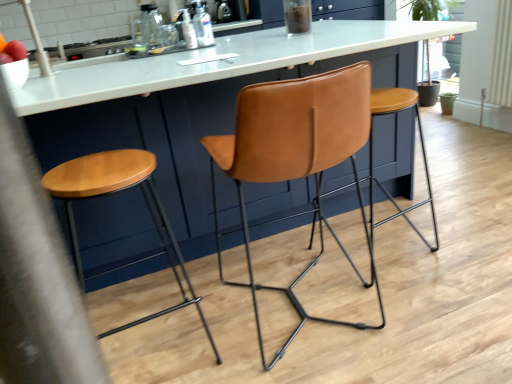
Question: Considering the relative positions of cognac leather chair at center and matte brown stool at center, which is counted as the first stool, starting from the left, in the image provided, is cognac leather chair at center to the right of matte brown stool at center, which is counted as the first stool, starting from the left, from the viewer's perspective?

Choices:
 (A) yes
 (B) no

Answer: (A)

Question: Does cognac leather chair at center have a lesser height compared to matte brown stool at center, which is counted as the first stool, starting from the left?

Choices:
 (A) yes
 (B) no

Answer: (B)

Question: Does cognac leather chair at center have a greater width compared to matte brown stool at center, which is counted as the first stool, starting from the left?

Choices:
 (A) no
 (B) yes

Answer: (B)

Question: Is cognac leather chair at center looking in the opposite direction of matte brown stool at center, which is counted as the first stool, starting from the left?

Choices:
 (A) yes
 (B) no

Answer: (B)

Question: Can you confirm if cognac leather chair at center is positioned to the left of matte brown stool at center, which is the 2th stool in right-to-left order?

Choices:
 (A) yes
 (B) no

Answer: (B)

Question: In the image, is matte brown stool at center, which is the 2th stool in right-to-left order, positioned in front of or behind cognac leather chair at center?

Choices:
 (A) behind
 (B) front

Answer: (A)

Question: Considering the positions of matte brown stool at center, which is counted as the first stool, starting from the left, and cognac leather chair at center in the image, is matte brown stool at center, which is counted as the first stool, starting from the left, bigger or smaller than cognac leather chair at center?

Choices:
 (A) big
 (B) small

Answer: (B)

Question: From a real-world perspective, is matte brown stool at center, which is counted as the first stool, starting from the left, above or below cognac leather chair at center?

Choices:
 (A) above
 (B) below

Answer: (B)

Question: From the image's perspective, is matte brown stool at center, which is the 2th stool in right-to-left order, located above or below cognac leather chair at center?

Choices:
 (A) below
 (B) above

Answer: (A)

Question: Based on their positions, is matte brown stool at center, which is the 2th stool in right-to-left order, located to the left or right of transparent glass bottle at upper center, the first bottle viewed from the left?

Choices:
 (A) left
 (B) right

Answer: (B)

Question: From a real-world perspective, is matte brown stool at center, which is counted as the first stool, starting from the left, physically located above or below transparent glass bottle at upper center, placed as the 3th bottle when sorted from front to back?

Choices:
 (A) above
 (B) below

Answer: (B)

Question: In terms of size, does matte brown stool at center, which is counted as the first stool, starting from the left, appear bigger or smaller than transparent glass bottle at upper center, which ranks as the 3th bottle in bottom-to-top order?

Choices:
 (A) small
 (B) big

Answer: (B)

Question: From the image's perspective, is matte brown stool at center, which is counted as the first stool, starting from the left, above or below transparent glass bottle at upper center, the first bottle from the back?

Choices:
 (A) below
 (B) above

Answer: (A)

Question: Which is correct: translucent plastic bottle at upper center, which ranks as the third bottle in back-to-front order, is inside transparent plastic bottle at upper center, the first bottle when ordered from right to left, or outside of it?

Choices:
 (A) inside
 (B) outside

Answer: (B)

Question: Considering the positions of translucent plastic bottle at upper center, the 2th bottle in the right-to-left sequence, and transparent plastic bottle at upper center, the first bottle when ordered from right to left, in the image, is translucent plastic bottle at upper center, the 2th bottle in the right-to-left sequence, wider or thinner than transparent plastic bottle at upper center, the first bottle when ordered from right to left,?

Choices:
 (A) wide
 (B) thin

Answer: (A)